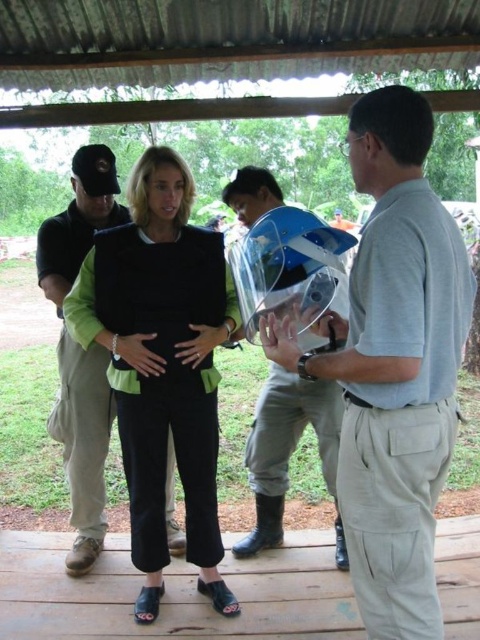
From the picture: Can you confirm if light gray cotton shirt at right is positioned below black matte vest at center?

No, light gray cotton shirt at right is not below black matte vest at center.

Who is positioned more to the left, light gray cotton shirt at right or black matte vest at center?

Positioned to the left is black matte vest at center.

I want to click on light gray cotton shirt at right, so click(394, 365).

The height and width of the screenshot is (640, 480). Find the location of `light gray cotton shirt at right`. light gray cotton shirt at right is located at coordinates (394, 365).

Looking at this image, between light gray cotton shirt at right and clear plastic helmet at center, which one appears on the right side from the viewer's perspective?

light gray cotton shirt at right is more to the right.

Describe the element at coordinates (394, 365) in the screenshot. The image size is (480, 640). I see `light gray cotton shirt at right` at that location.

Is point (391, 177) in front of point (337, 298)?

Yes, it is.

This screenshot has width=480, height=640. What are the coordinates of `light gray cotton shirt at right` in the screenshot? It's located at (394, 365).

Who is more distant from viewer, (154, 323) or (240, 200)?

The point (240, 200) is more distant.

Is black matte vest at center taller than clear plastic helmet at center?

Yes.

Is point (144, 429) less distant than point (323, 422)?

Yes, it is.

At what (x,y) coordinates should I click in order to perform the action: click on black matte vest at center. Please return your answer as a coordinate pair (x, y). Looking at the image, I should click on (162, 364).